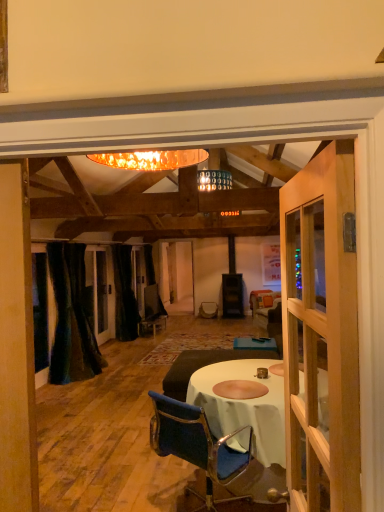
Question: Is wooden door at right at the left side of velvet dark brown couch at center?

Choices:
 (A) no
 (B) yes

Answer: (B)

Question: Is wooden door at right next to velvet dark brown couch at center?

Choices:
 (A) no
 (B) yes

Answer: (A)

Question: Does wooden door at right have a greater height compared to velvet dark brown couch at center?

Choices:
 (A) no
 (B) yes

Answer: (B)

Question: Is wooden door at right to the right of velvet dark brown couch at center from the viewer's perspective?

Choices:
 (A) yes
 (B) no

Answer: (B)

Question: Does wooden door at right turn towards velvet dark brown couch at center?

Choices:
 (A) yes
 (B) no

Answer: (B)

Question: Can you confirm if wooden door at right is shorter than velvet dark brown couch at center?

Choices:
 (A) yes
 (B) no

Answer: (B)

Question: Is velvet blue chair at center shorter than black velvet curtain at center, the 2th curtain in the front-to-back sequence?

Choices:
 (A) no
 (B) yes

Answer: (B)

Question: Is velvet blue chair at center looking in the opposite direction of black velvet curtain at center, which ranks as the first curtain in back-to-front order?

Choices:
 (A) no
 (B) yes

Answer: (A)

Question: Does velvet blue chair at center turn towards black velvet curtain at center, the 2th curtain in the front-to-back sequence?

Choices:
 (A) no
 (B) yes

Answer: (A)

Question: Does velvet blue chair at center have a smaller size compared to black velvet curtain at center, the 2th curtain in the front-to-back sequence?

Choices:
 (A) no
 (B) yes

Answer: (B)

Question: Does velvet blue chair at center have a lesser width compared to black velvet curtain at center, which ranks as the first curtain in back-to-front order?

Choices:
 (A) yes
 (B) no

Answer: (B)

Question: Does velvet blue chair at center have a greater width compared to black velvet curtain at center, which ranks as the first curtain in back-to-front order?

Choices:
 (A) no
 (B) yes

Answer: (B)

Question: Is black velvet curtain at center, which ranks as the first curtain in back-to-front order, at the right side of velvet dark brown couch at center?

Choices:
 (A) yes
 (B) no

Answer: (B)